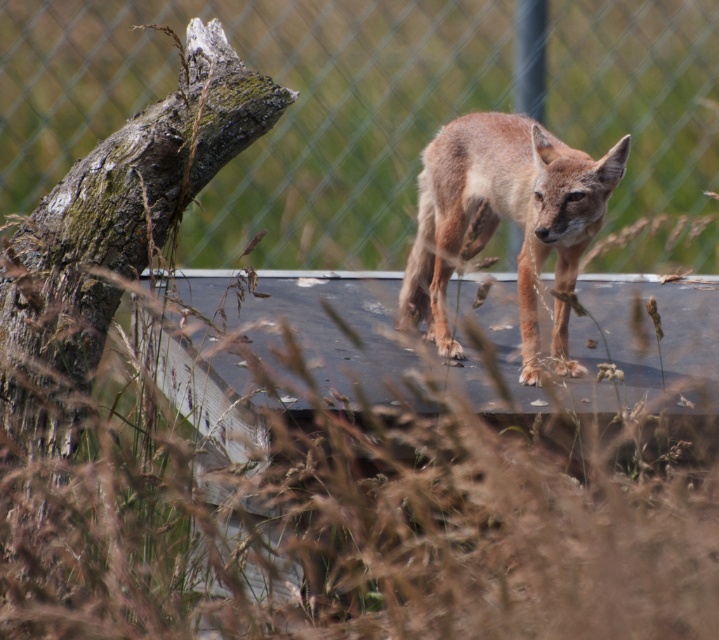
Who is positioned more to the right, metallic chain-link fence at center or brown fur fox at center?

Positioned to the right is brown fur fox at center.

Locate an element on the screen. metallic chain-link fence at center is located at coordinates (275, 124).

You are a GUI agent. You are given a task and a screenshot of the screen. Output one action in this format:
    pyautogui.click(x=<x>, y=<y>)
    Task: Click on the metallic chain-link fence at center
    This screenshot has width=719, height=640.
    Given the screenshot: What is the action you would take?
    pyautogui.click(x=275, y=124)

Which is in front, point (45, 522) or point (429, 333)?

Positioned in front is point (45, 522).

Which is behind, point (47, 500) or point (531, 198)?

The point (531, 198) is behind.

Locate an element on the screen. This screenshot has height=640, width=719. grayish-brown bark tree trunk at left is located at coordinates (96, 292).

Who is more distant from viewer, (1, 80) or (224, 150)?

Point (1, 80)

Is metallic chain-link fence at center positioned behind grayish-brown bark tree trunk at left?

That is True.

Who is more distant from viewer, (x=91, y=83) or (x=22, y=483)?

The point (x=91, y=83) is behind.

This screenshot has width=719, height=640. Find the location of `metallic chain-link fence at center`. metallic chain-link fence at center is located at coordinates (275, 124).